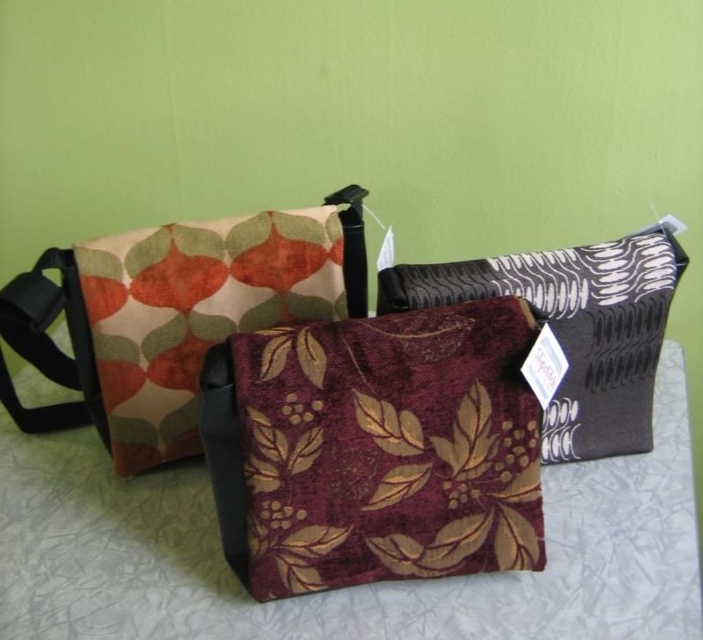
Question: Is burgundy velvet pouch at center smaller than velvety floral pouch at center?

Choices:
 (A) no
 (B) yes

Answer: (B)

Question: Estimate the real-world distances between objects in this image. Which object is farther from the burgundy velvet pouch at center?

Choices:
 (A) burgundy velvety pouch at center
 (B) velvety floral pouch at center

Answer: (B)

Question: Which object is the closest to the burgundy velvety pouch at center?

Choices:
 (A) velvety floral pouch at center
 (B) burgundy velvet pouch at center

Answer: (B)

Question: Does burgundy velvety pouch at center have a lesser width compared to velvety floral pouch at center?

Choices:
 (A) no
 (B) yes

Answer: (B)

Question: Which point is farther to the camera?

Choices:
 (A) burgundy velvet pouch at center
 (B) velvety floral pouch at center
 (C) burgundy velvety pouch at center

Answer: (B)

Question: Can you confirm if burgundy velvet pouch at center is positioned above velvety floral pouch at center?

Choices:
 (A) no
 (B) yes

Answer: (A)